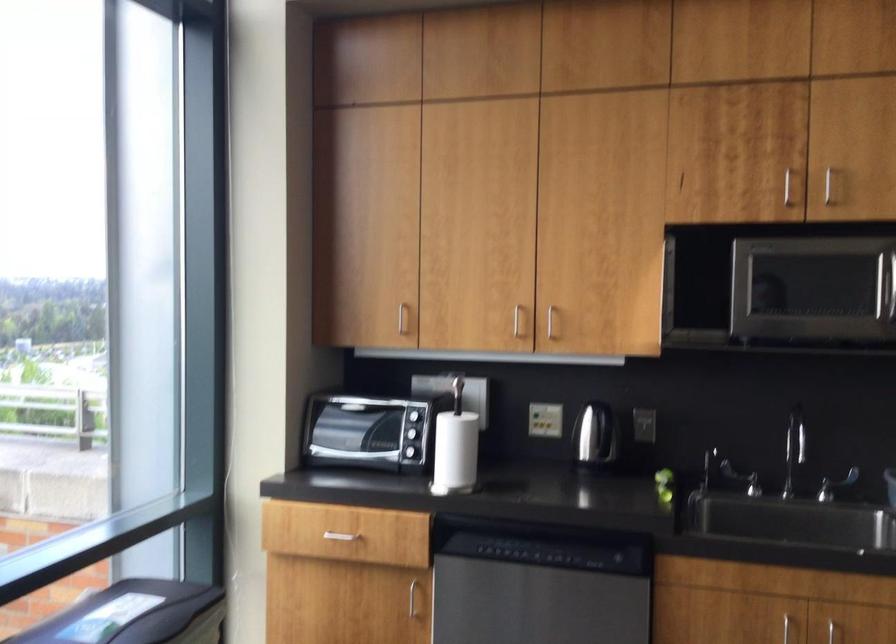
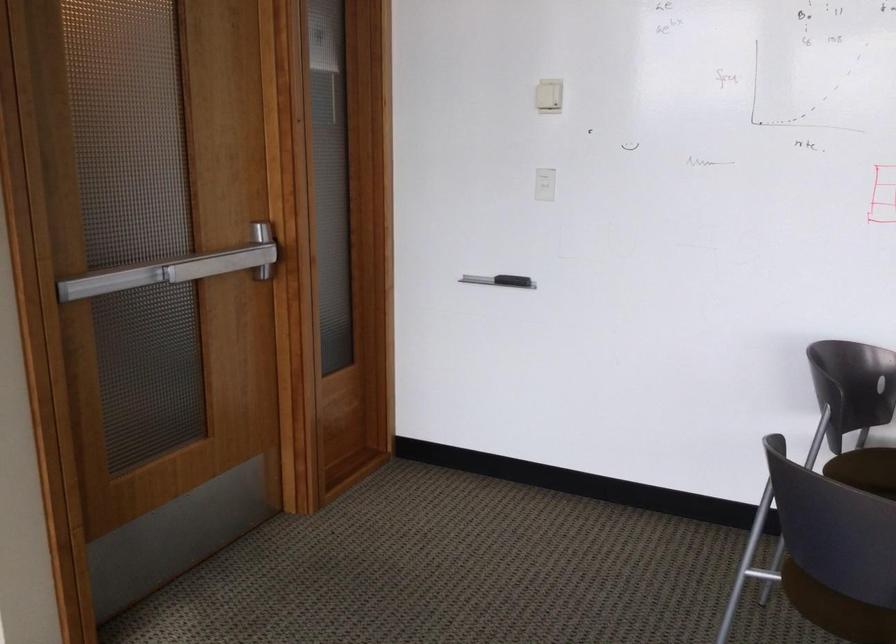
Question: Based on the continuous images, in which direction is the camera rotating? Reply with the corresponding letter.

Choices:
 (A) Left
 (B) Right
 (C) Up
 (D) Down

Answer: (B)